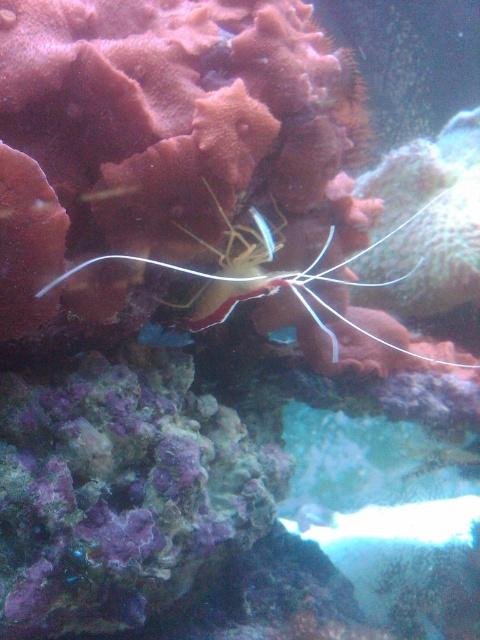
Between point (180, 337) and point (315, 506), which one is positioned behind?

The point (315, 506) is behind.

Measure the distance between shiny blue fish at center and camera.

shiny blue fish at center is 4.08 feet away from camera.

This screenshot has width=480, height=640. In order to click on shiny blue fish at center in this screenshot , I will do `click(164, 336)`.

Does translucent white shrimp at center have a greater width compared to shiny blue fish at center?

Correct, the width of translucent white shrimp at center exceeds that of shiny blue fish at center.

Is translucent white shrimp at center above shiny blue fish at center?

Correct, translucent white shrimp at center is located above shiny blue fish at center.

Between point (369, 246) and point (163, 326), which one is positioned behind?

The point (369, 246) is more distant.

I want to click on translucent white shrimp at center, so click(266, 282).

Does translucent white shrimp at center have a larger size compared to translucent white fish at center?

Yes, translucent white shrimp at center is bigger than translucent white fish at center.

Does point (193, 301) come farther from viewer compared to point (313, 502)?

No, (193, 301) is in front of (313, 502).

Is point (189, 305) positioned after point (312, 502)?

No, (189, 305) is closer to viewer.

Where is `translucent white shrimp at center`? translucent white shrimp at center is located at coordinates (266, 282).